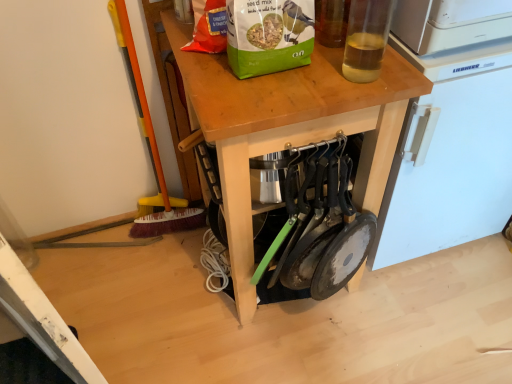
Question: Is wooden at center to the left of white plastic refrigerator at upper right from the viewer's perspective?

Choices:
 (A) no
 (B) yes

Answer: (B)

Question: Can you confirm if wooden at center is bigger than white plastic refrigerator at upper right?

Choices:
 (A) yes
 (B) no

Answer: (A)

Question: Could white plastic refrigerator at upper right be considered to be inside wooden at center?

Choices:
 (A) yes
 (B) no

Answer: (B)

Question: From a real-world perspective, is wooden at center positioned under white plastic refrigerator at upper right based on gravity?

Choices:
 (A) no
 (B) yes

Answer: (B)

Question: Can you confirm if wooden at center is taller than white plastic refrigerator at upper right?

Choices:
 (A) no
 (B) yes

Answer: (A)

Question: Is wooden at center thinner than white plastic refrigerator at upper right?

Choices:
 (A) no
 (B) yes

Answer: (A)

Question: From the image's perspective, is translucent glass bottle at upper right on white plastic refrigerator at upper right?

Choices:
 (A) no
 (B) yes

Answer: (B)

Question: Does translucent glass bottle at upper right have a greater height compared to white plastic refrigerator at upper right?

Choices:
 (A) yes
 (B) no

Answer: (B)

Question: Is translucent glass bottle at upper right further to camera compared to white plastic refrigerator at upper right?

Choices:
 (A) yes
 (B) no

Answer: (B)

Question: Is translucent glass bottle at upper right looking in the opposite direction of white plastic refrigerator at upper right?

Choices:
 (A) yes
 (B) no

Answer: (B)

Question: Considering the relative sizes of translucent glass bottle at upper right and white plastic refrigerator at upper right in the image provided, is translucent glass bottle at upper right shorter than white plastic refrigerator at upper right?

Choices:
 (A) no
 (B) yes

Answer: (B)

Question: Considering the relative positions of translucent glass bottle at upper right and white plastic refrigerator at upper right in the image provided, is translucent glass bottle at upper right to the left of white plastic refrigerator at upper right from the viewer's perspective?

Choices:
 (A) yes
 (B) no

Answer: (A)

Question: Considering the relative sizes of white plastic refrigerator at upper right and wooden at center in the image provided, is white plastic refrigerator at upper right smaller than wooden at center?

Choices:
 (A) no
 (B) yes

Answer: (B)